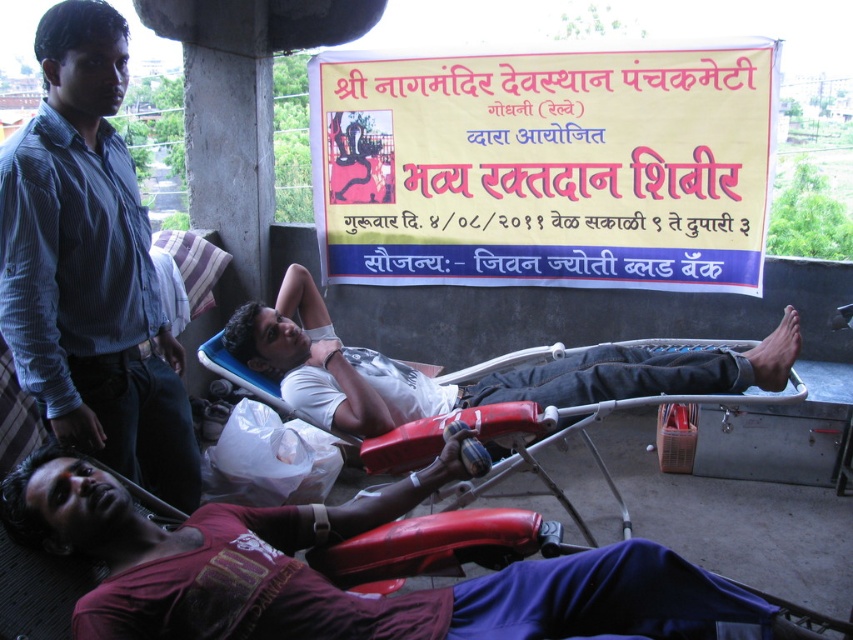
Question: Which point appears farthest from the camera in this image?

Choices:
 (A) (265, 580)
 (B) (172, 470)
 (C) (312, 312)

Answer: (C)

Question: Does yellow paper banner at upper center have a smaller size compared to white matte t-shirt at center?

Choices:
 (A) no
 (B) yes

Answer: (A)

Question: Does yellow paper banner at upper center appear on the left side of red plastic stretcher at center?

Choices:
 (A) yes
 (B) no

Answer: (B)

Question: Based on their relative distances, which object is nearer to the blue striped shirt at upper left?

Choices:
 (A) red plastic stretcher at center
 (B) yellow paper banner at upper center

Answer: (A)

Question: Does yellow paper banner at upper center appear under maroon cotton shirt at lower left?

Choices:
 (A) no
 (B) yes

Answer: (A)

Question: Which point appears farthest from the camera in this image?

Choices:
 (A) (171, 484)
 (B) (618, 564)
 (C) (213, 352)

Answer: (C)